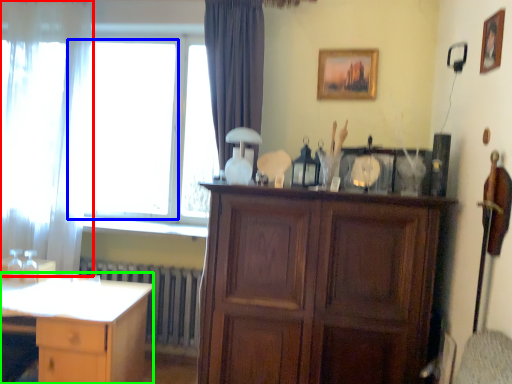
Question: Estimate the real-world distances between objects in this image. Which object is farther from curtain (highlighted by a red box), window (highlighted by a blue box) or desk (highlighted by a green box)?

Choices:
 (A) window
 (B) desk

Answer: (B)